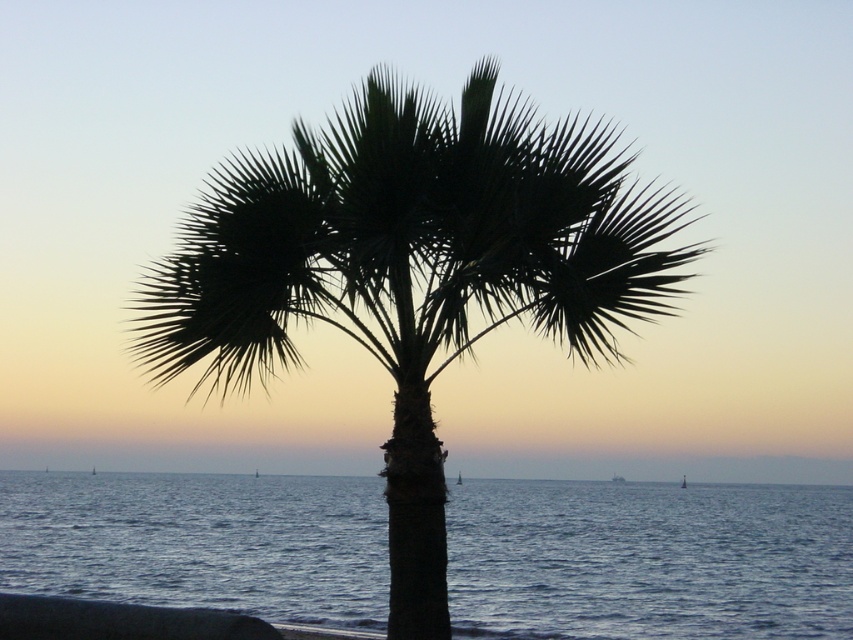
Can you confirm if silhouette leafy palm at center is positioned to the left of dark blue water at center?

Incorrect, silhouette leafy palm at center is not on the left side of dark blue water at center.

Is silhouette leafy palm at center below dark blue water at center?

Incorrect, silhouette leafy palm at center is not positioned below dark blue water at center.

In order to click on silhouette leafy palm at center in this screenshot , I will do `click(412, 269)`.